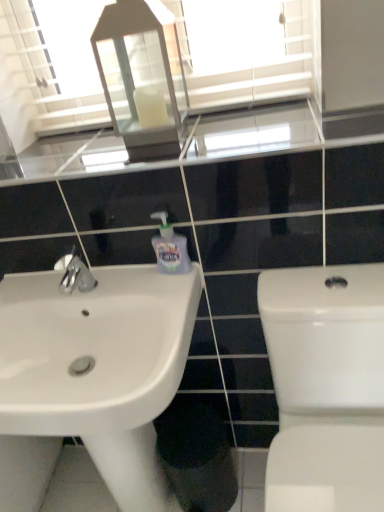
Question: Would you say white glass lantern at upper center is to the left or to the right of white glossy sink at lower left in the picture?

Choices:
 (A) right
 (B) left

Answer: (A)

Question: In terms of size, does white glass lantern at upper center appear bigger or smaller than white glossy sink at lower left?

Choices:
 (A) big
 (B) small

Answer: (B)

Question: Which of these objects is positioned farthest from the white glossy sink at lower left?

Choices:
 (A) clear glass mirror at upper center
 (B) white glossy toilet at right
 (C) white glass lantern at upper center
 (D) translucent plastic soap dispenser at center

Answer: (C)

Question: Which of these objects is positioned farthest from the white glossy toilet at right?

Choices:
 (A) white glossy sink at lower left
 (B) white glass lantern at upper center
 (C) clear glass mirror at upper center
 (D) translucent plastic soap dispenser at center

Answer: (C)